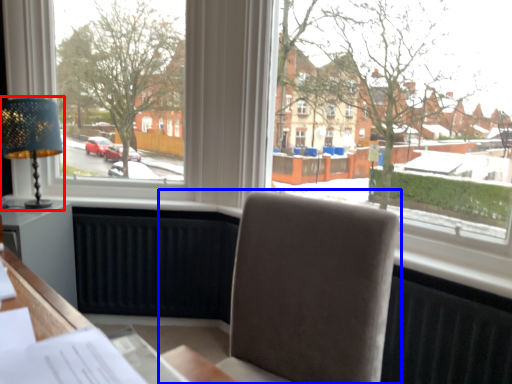
Question: Which point is further to the camera, table lamp (highlighted by a red box) or chair (highlighted by a blue box)?

Choices:
 (A) table lamp
 (B) chair

Answer: (A)